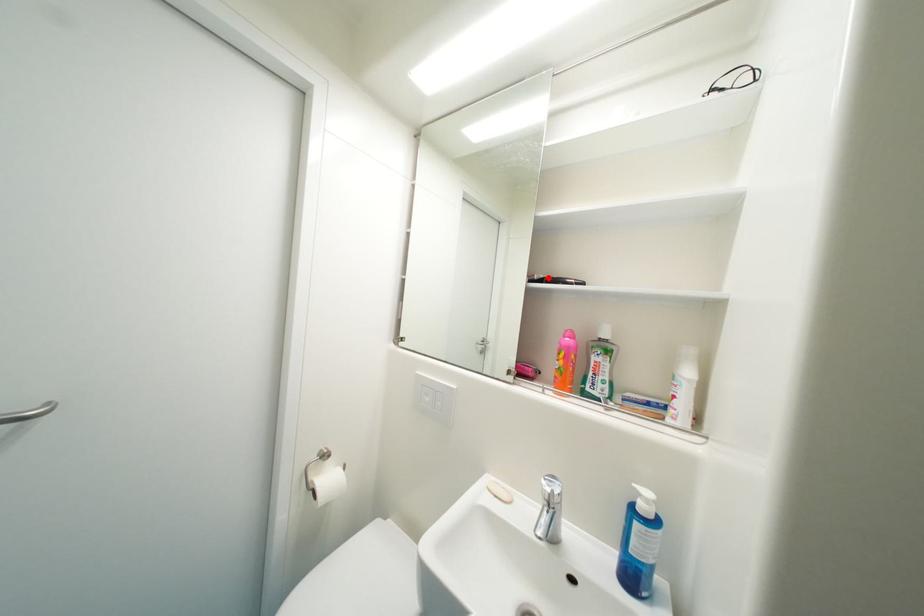
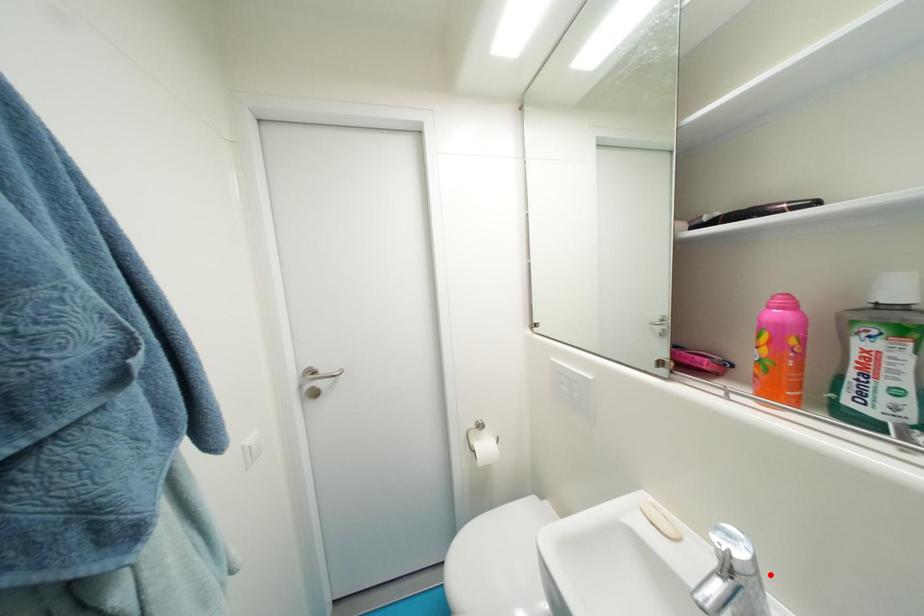
I am providing you with two images of the same scene from different viewpoints. A red point is marked on the first image and another point is marked on the second image. Does the point marked in image1 correspond to the same location as the one in image2?

No